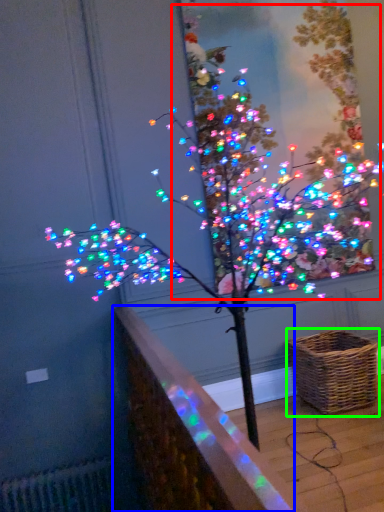
Question: Estimate the real-world distances between objects in this image. Which object is farther from christmas tree (highlighted by a red box), ledge (highlighted by a blue box) or picnic basket (highlighted by a green box)?

Choices:
 (A) ledge
 (B) picnic basket

Answer: (A)